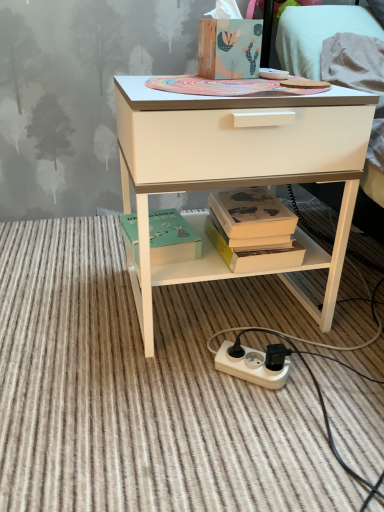
Image resolution: width=384 pixels, height=512 pixels. I want to click on vacant area that lies in front of white plastic power outlet at lower center, so [258, 437].